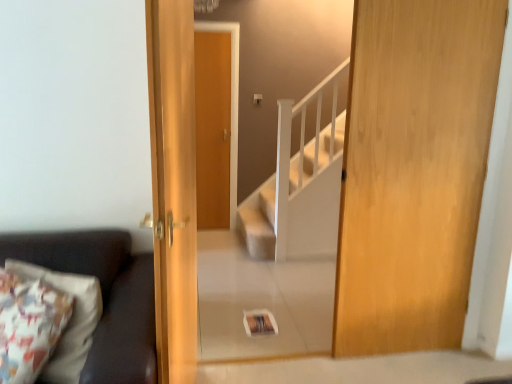
Question: Does point (414, 238) appear closer or farther from the camera than point (185, 0)?

Choices:
 (A) closer
 (B) farther

Answer: (B)

Question: Choose the correct answer: Is wooden door at right, which is counted as the second door, starting from the left, inside wooden door at center, acting as the 2th door starting from the right, or outside it?

Choices:
 (A) inside
 (B) outside

Answer: (B)

Question: Estimate the real-world distances between objects in this image. Which object is farther from the dark brown leather couch at left?

Choices:
 (A) wooden door at center, which is the first door from left to right
 (B) wooden door at right, positioned as the first door in right-to-left order

Answer: (B)

Question: Considering the real-world distances, which object is farthest from the wooden door at right, which is counted as the second door, starting from the left?

Choices:
 (A) dark brown leather couch at left
 (B) wooden door at center, acting as the 2th door starting from the right

Answer: (A)